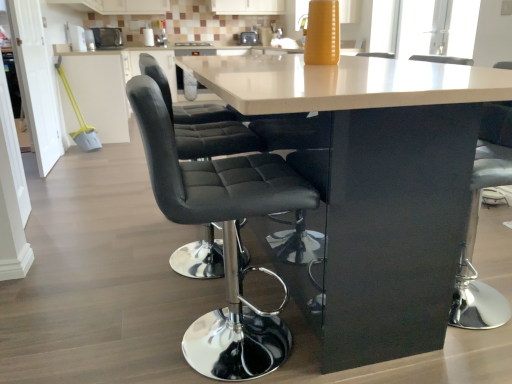
Question: Is metallic silver toaster at upper left, the 1th appliance viewed from the left, oriented towards metallic silver toaster at center, which is the first appliance from right to left?

Choices:
 (A) yes
 (B) no

Answer: (B)

Question: Does metallic silver toaster at upper left, the 1th appliance viewed from the left, have a lesser width compared to metallic silver toaster at center, placed as the 2th appliance when sorted from front to back?

Choices:
 (A) yes
 (B) no

Answer: (B)

Question: From the image's perspective, is metallic silver toaster at upper left, which appears as the first appliance when viewed from the front, on metallic silver toaster at center, which is the first appliance from right to left?

Choices:
 (A) yes
 (B) no

Answer: (B)

Question: Is metallic silver toaster at center, acting as the 1th appliance starting from the back, located within metallic silver toaster at upper left, which appears as the first appliance when viewed from the front?

Choices:
 (A) yes
 (B) no

Answer: (B)

Question: Considering the relative positions of metallic silver toaster at upper left, which appears as the first appliance when viewed from the front, and metallic silver toaster at center, placed as the 2th appliance when sorted from front to back, in the image provided, is metallic silver toaster at upper left, which appears as the first appliance when viewed from the front, in front of metallic silver toaster at center, placed as the 2th appliance when sorted from front to back,?

Choices:
 (A) yes
 (B) no

Answer: (A)

Question: Does metallic silver toaster at upper left, the second appliance in the back-to-front sequence, appear on the left side of metallic silver toaster at center, acting as the 1th appliance starting from the back?

Choices:
 (A) no
 (B) yes

Answer: (B)

Question: Considering the relative sizes of glossy black table at center and white glossy counter at center in the image provided, is glossy black table at center wider than white glossy counter at center?

Choices:
 (A) yes
 (B) no

Answer: (B)

Question: Does glossy black table at center have a lesser height compared to white glossy counter at center?

Choices:
 (A) yes
 (B) no

Answer: (A)

Question: Can you confirm if glossy black table at center is positioned to the right of white glossy counter at center?

Choices:
 (A) yes
 (B) no

Answer: (A)

Question: Is glossy black table at center oriented towards white glossy counter at center?

Choices:
 (A) yes
 (B) no

Answer: (B)

Question: Is glossy black table at center not near white glossy counter at center?

Choices:
 (A) yes
 (B) no

Answer: (A)

Question: Is the depth of glossy black table at center less than that of white glossy counter at center?

Choices:
 (A) yes
 (B) no

Answer: (A)

Question: Is metallic silver toaster at upper left, the 1th appliance viewed from the left, directly adjacent to white glossy cabinet at upper left?

Choices:
 (A) yes
 (B) no

Answer: (B)